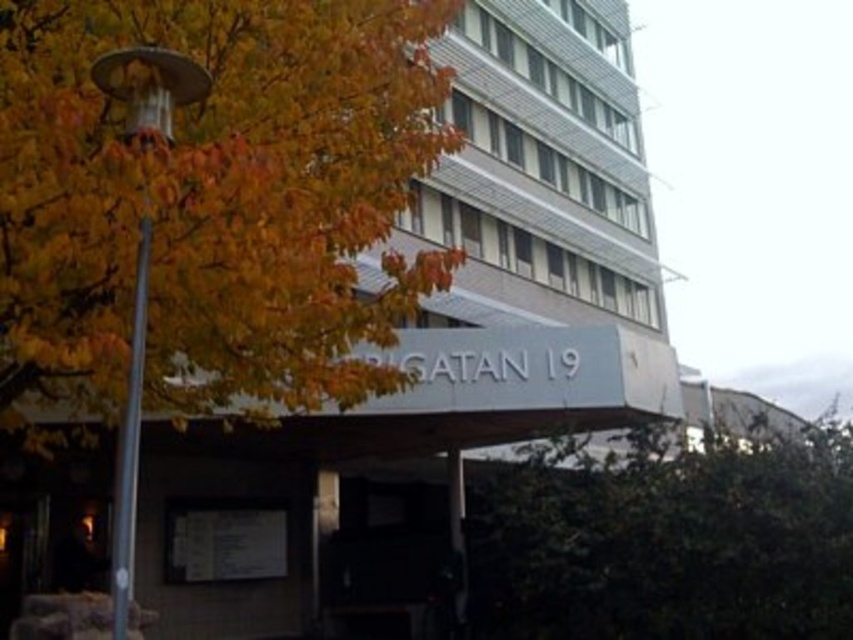
Question: Which object is closer to the camera taking this photo?

Choices:
 (A) green leafy tree at center
 (B) yellow leafy tree at left

Answer: (B)

Question: Where is yellow leafy tree at left located in relation to green leafy tree at center in the image?

Choices:
 (A) left
 (B) right

Answer: (A)

Question: Does yellow leafy tree at left lie behind metallic pole at left?

Choices:
 (A) yes
 (B) no

Answer: (B)

Question: Can you confirm if yellow leafy tree at left is positioned above metallic pole at left?

Choices:
 (A) no
 (B) yes

Answer: (B)

Question: Estimate the real-world distances between objects in this image. Which object is farther from the metallic pole at left?

Choices:
 (A) green leafy tree at center
 (B) yellow leafy tree at left

Answer: (A)

Question: Which point appears closest to the camera in this image?

Choices:
 (A) (604, 611)
 (B) (196, 212)

Answer: (B)